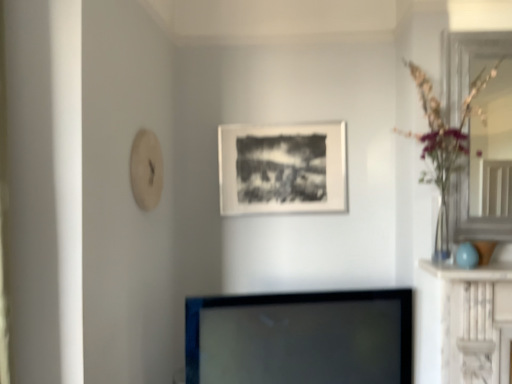
Question: Can you confirm if matte black picture frame at center is smaller than clear glass vase at right?

Choices:
 (A) no
 (B) yes

Answer: (B)

Question: Is matte black picture frame at center directly adjacent to clear glass vase at right?

Choices:
 (A) yes
 (B) no

Answer: (B)

Question: Is matte black picture frame at center further to the viewer compared to clear glass vase at right?

Choices:
 (A) no
 (B) yes

Answer: (B)

Question: Is matte black picture frame at center taller than clear glass vase at right?

Choices:
 (A) yes
 (B) no

Answer: (B)

Question: From a real-world perspective, is matte black picture frame at center below clear glass vase at right?

Choices:
 (A) no
 (B) yes

Answer: (B)

Question: Visually, is clear glass door at right positioned to the left or to the right of black glossy tv at center?

Choices:
 (A) left
 (B) right

Answer: (B)

Question: Considering the positions of point (462, 183) and point (404, 319), is point (462, 183) closer or farther from the camera than point (404, 319)?

Choices:
 (A) farther
 (B) closer

Answer: (B)

Question: Relative to black glossy tv at center, is clear glass door at right in front or behind?

Choices:
 (A) behind
 (B) front

Answer: (A)

Question: From a real-world perspective, relative to black glossy tv at center, is clear glass door at right vertically above or below?

Choices:
 (A) above
 (B) below

Answer: (A)

Question: Based on their sizes in the image, would you say clear glass door at right is bigger or smaller than clear glass vase at right?

Choices:
 (A) small
 (B) big

Answer: (A)

Question: From the image's perspective, is clear glass door at right located above or below clear glass vase at right?

Choices:
 (A) above
 (B) below

Answer: (A)

Question: In the image, is clear glass door at right on the left side or the right side of clear glass vase at right?

Choices:
 (A) left
 (B) right

Answer: (B)

Question: Considering the positions of point (503, 66) and point (432, 175), is point (503, 66) closer or farther from the camera than point (432, 175)?

Choices:
 (A) farther
 (B) closer

Answer: (B)

Question: From a real-world perspective, is clear glass vase at right positioned above or below matte black picture frame at center?

Choices:
 (A) below
 (B) above

Answer: (B)

Question: Looking at their shapes, would you say clear glass vase at right is wider or thinner than matte black picture frame at center?

Choices:
 (A) wide
 (B) thin

Answer: (A)